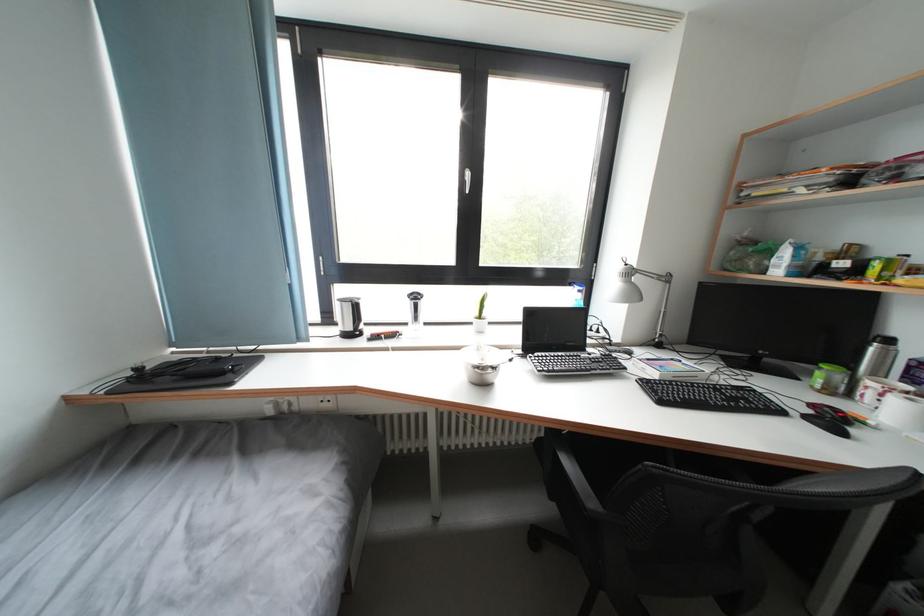
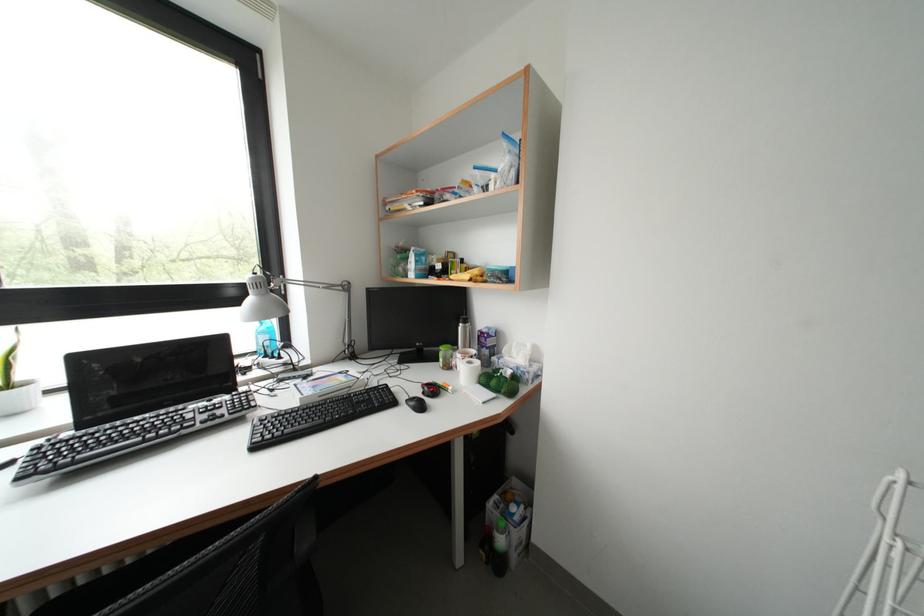
In the second image, find the point that corresponds to (x=879, y=354) in the first image.

(467, 333)